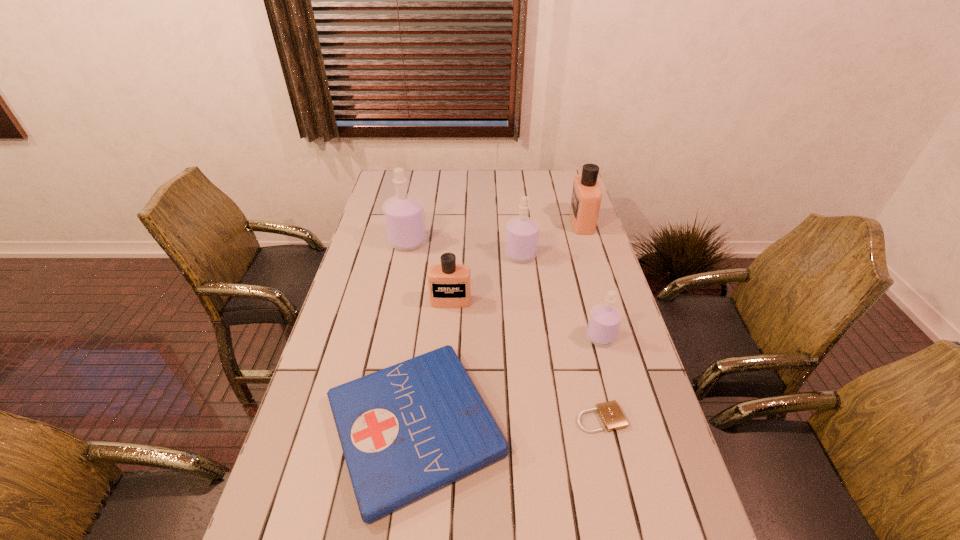
Find the location of a particular element. Image resolution: width=960 pixels, height=540 pixels. the first-aid kit is located at coordinates (406, 431).

What are the coordinates of `blue first-aid kit` in the screenshot? It's located at (406, 431).

Image resolution: width=960 pixels, height=540 pixels. In order to click on the shortest object in this screenshot , I will do `click(612, 417)`.

Locate an element on the screen. The image size is (960, 540). padlock is located at coordinates (612, 417).

The image size is (960, 540). Find the location of `vacant space located 0.390m on the front of the biggest purple perfume`. vacant space located 0.390m on the front of the biggest purple perfume is located at coordinates (389, 334).

Where is `free space located on the left of the third perfume from left to right`? free space located on the left of the third perfume from left to right is located at coordinates (411, 255).

Locate an element on the screen. The image size is (960, 540). vacant region located 0.360m on the front label of the bigger beige perfume is located at coordinates (480, 222).

Identify the location of free space located 0.090m on the front label of the bigger beige perfume. (548, 222).

You are a GUI agent. You are given a task and a screenshot of the screen. Output one action in this format:
    pyautogui.click(x=<x>, y=<y>)
    Task: Click on the vacant space located on the front label of the bigger beige perfume
    This screenshot has height=540, width=960.
    Given the screenshot: What is the action you would take?
    pyautogui.click(x=545, y=222)

Find the location of a particular element. The image size is (960, 540). free space located on the front of the nearest perfume is located at coordinates (640, 485).